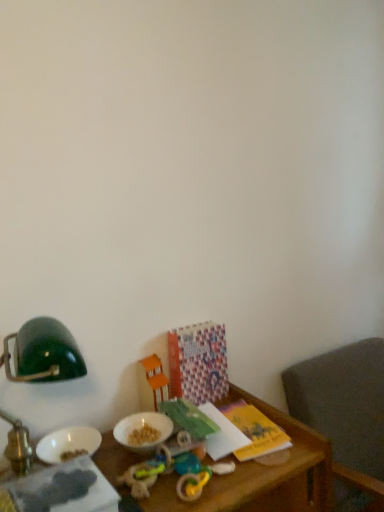
Where is `free space that is to the left of rubber teething ring at lower center, which is counted as the 3th toy, starting from the back`? free space that is to the left of rubber teething ring at lower center, which is counted as the 3th toy, starting from the back is located at coordinates (139, 481).